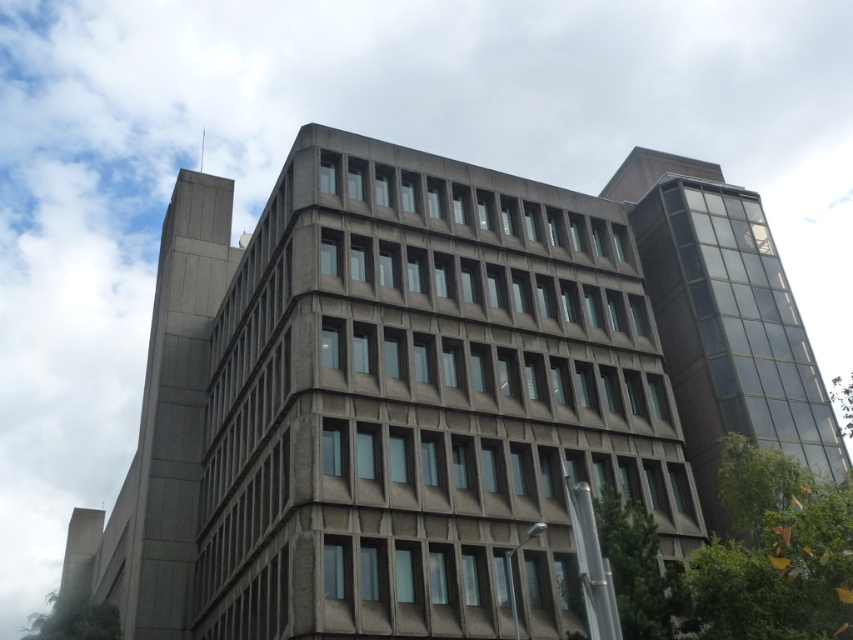
Between dark glass tower at right and gray concrete tower at upper left, which one is positioned higher?

dark glass tower at right

Does point (689, 337) come behind point (154, 532)?

That is False.

Is point (778, 376) positioned before point (132, 564)?

Yes, point (778, 376) is in front of point (132, 564).

Locate an element on the screen. Image resolution: width=853 pixels, height=640 pixels. dark glass tower at right is located at coordinates (724, 320).

Is gray concrete building at center to the right of dark glass tower at right from the viewer's perspective?

Incorrect, gray concrete building at center is not on the right side of dark glass tower at right.

Is gray concrete building at center further to camera compared to dark glass tower at right?

That is False.

Which is in front, point (416, 381) or point (744, 211)?

Point (416, 381) is more forward.

The image size is (853, 640). I want to click on gray concrete building at center, so click(425, 400).

Does gray concrete building at center have a greater width compared to gray concrete tower at upper left?

Correct, the width of gray concrete building at center exceeds that of gray concrete tower at upper left.

Which is below, gray concrete building at center or gray concrete tower at upper left?

gray concrete tower at upper left is below.

This screenshot has width=853, height=640. Describe the element at coordinates (425, 400) in the screenshot. I see `gray concrete building at center` at that location.

Locate an element on the screen. The width and height of the screenshot is (853, 640). gray concrete building at center is located at coordinates (425, 400).